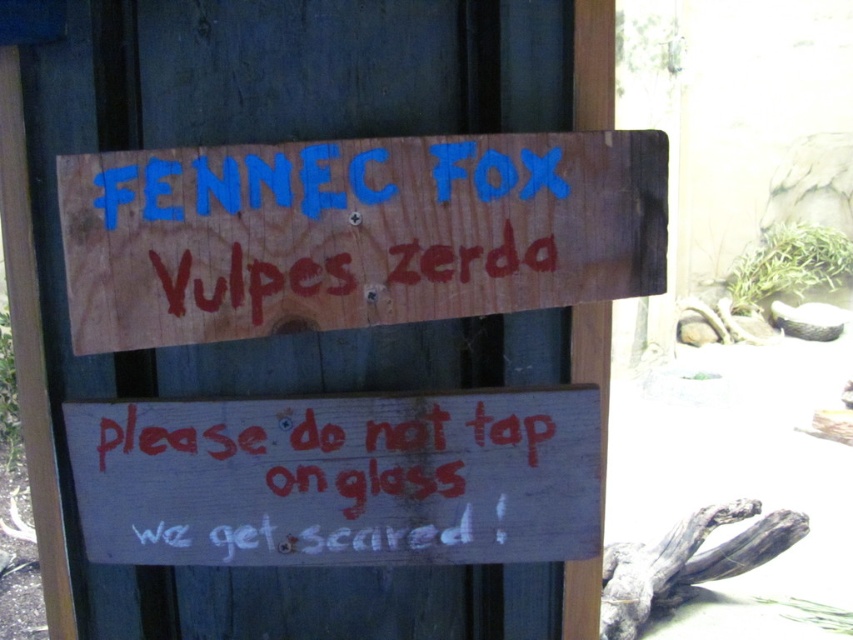
Question: Which of the following is the closest to the observer?

Choices:
 (A) white painted wood sign at lower center
 (B) wooden signboard at upper center

Answer: (B)

Question: Does wooden signboard at upper center have a greater width compared to white painted wood sign at lower center?

Choices:
 (A) yes
 (B) no

Answer: (A)

Question: Can you confirm if wooden signboard at upper center is positioned below white painted wood sign at lower center?

Choices:
 (A) no
 (B) yes

Answer: (A)

Question: Can you confirm if wooden signboard at upper center is smaller than white painted wood sign at lower center?

Choices:
 (A) no
 (B) yes

Answer: (A)

Question: Which of the following is the closest to the observer?

Choices:
 (A) (x=654, y=141)
 (B) (x=86, y=502)

Answer: (A)